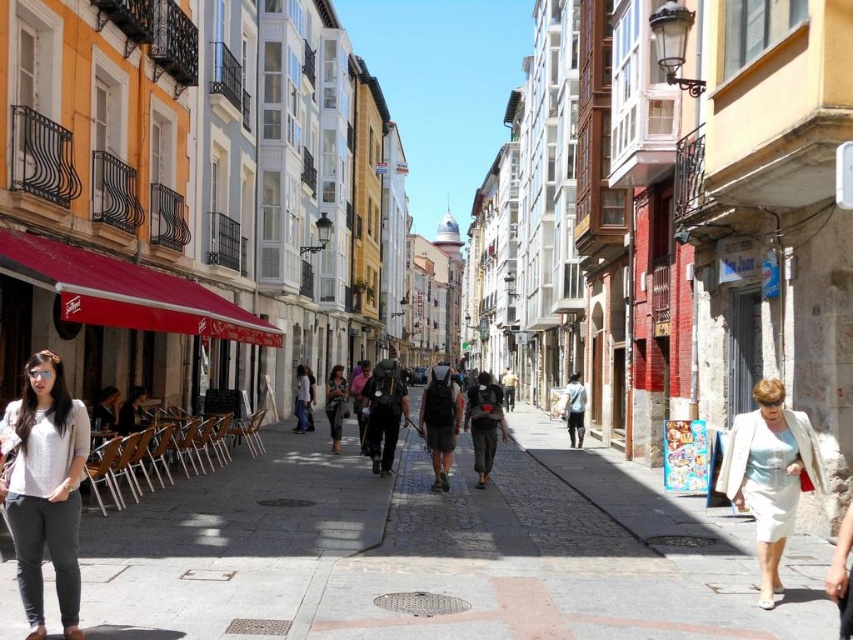
Does smooth concrete sidewalk at center appear on the right side of dark gray backpack at center?

Correct, you'll find smooth concrete sidewalk at center to the right of dark gray backpack at center.

Is point (799, 536) farther from camera compared to point (340, 438)?

No, (799, 536) is closer to viewer.

Locate an element on the screen. smooth concrete sidewalk at center is located at coordinates (438, 552).

The height and width of the screenshot is (640, 853). In order to click on smooth concrete sidewalk at center in this screenshot , I will do `click(438, 552)`.

Which of these two, light gray cotton pants at lower left or dark gray backpack at center, stands shorter?

dark gray backpack at center

Who is more distant from viewer, [74,582] or [331,376]?

The point [331,376] is more distant.

Locate an element on the screen. light gray cotton pants at lower left is located at coordinates (45, 488).

This screenshot has width=853, height=640. What do you see at coordinates (438, 552) in the screenshot?
I see `smooth concrete sidewalk at center` at bounding box center [438, 552].

Is point (722, 560) closer to camera compared to point (32, 490)?

No, it is not.

Image resolution: width=853 pixels, height=640 pixels. I want to click on smooth concrete sidewalk at center, so click(x=438, y=552).